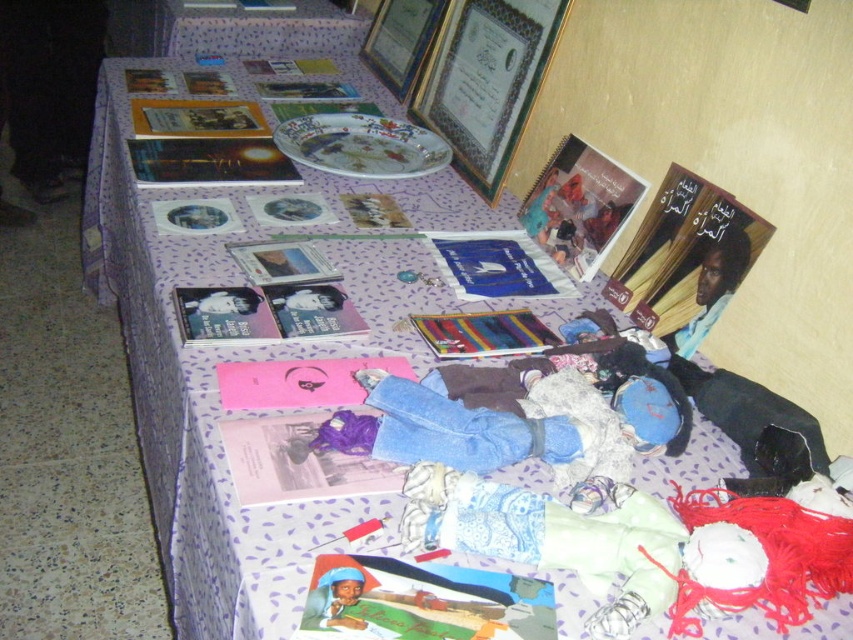
Does gold metallic picture frame at upper center lie behind wooden picture frame at upper center?

That is False.

This screenshot has height=640, width=853. I want to click on gold metallic picture frame at upper center, so click(486, 81).

Find the location of a particular element. gold metallic picture frame at upper center is located at coordinates (486, 81).